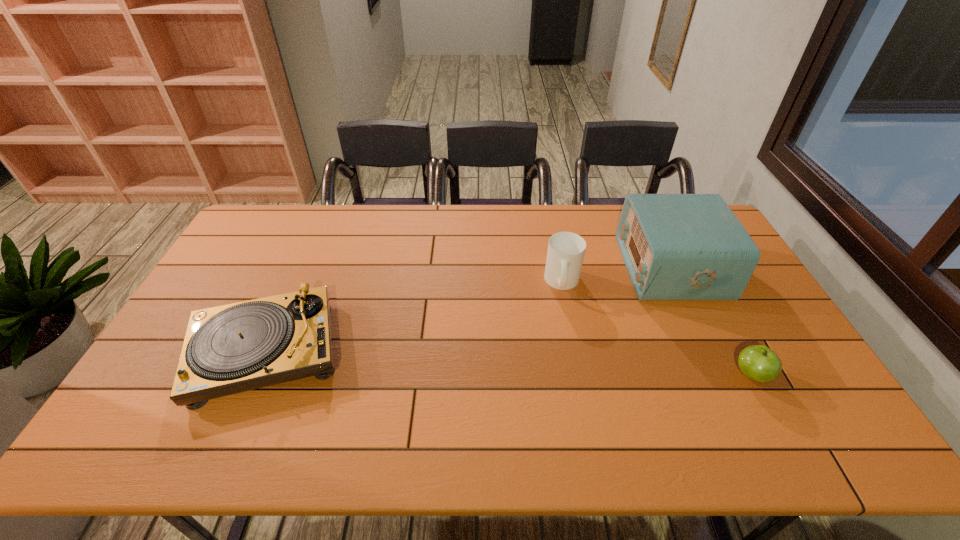
Locate an element on the screen. the tallest object is located at coordinates (675, 246).

Image resolution: width=960 pixels, height=540 pixels. Identify the location of mug. tap(566, 250).

The width and height of the screenshot is (960, 540). Identify the location of the third shortest object. (566, 250).

Locate an element on the screen. the leftmost object is located at coordinates (229, 349).

The width and height of the screenshot is (960, 540). In order to click on apple in this screenshot , I will do `click(759, 363)`.

In order to click on vacant region located 0.200m on the front panel of the radio receiver in this screenshot , I will do `click(564, 268)`.

Identify the location of free location located on the front panel of the radio receiver. This screenshot has height=540, width=960. (588, 268).

Identify the location of free space located on the front panel of the radio receiver. Image resolution: width=960 pixels, height=540 pixels. (577, 268).

At what (x,y) coordinates should I click in order to perform the action: click on free space located 0.300m on the handle side of the mug. Please return your answer as a coordinate pair (x, y). Image resolution: width=960 pixels, height=540 pixels. Looking at the image, I should click on (583, 382).

At what (x,y) coordinates should I click in order to perform the action: click on vacant space located 0.360m on the right of the record player. Please return your answer as a coordinate pair (x, y). Looking at the image, I should click on (476, 352).